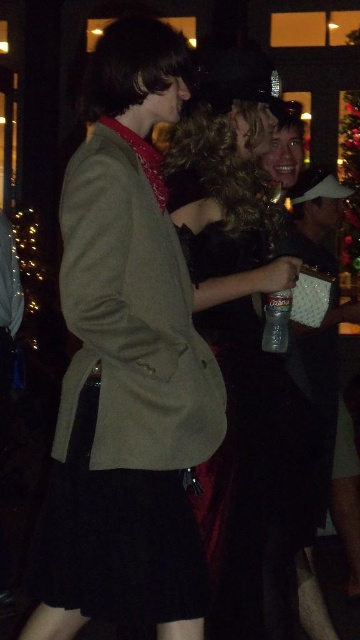
You are at a party and want to take a photo of the two dresses at the center. Which one will appear larger in your photo, the black cotton dress at center or the velvet black dress at center?

The black cotton dress at center will appear larger in the photo because it is closer to the viewer than the velvet black dress at center.

You are at a party and want to take a photo of the black cotton dress at center and the green fabric christmas tree at upper right. Which object is nearer to you?

The black cotton dress at center is closer to the viewer than the green fabric christmas tree at upper right.